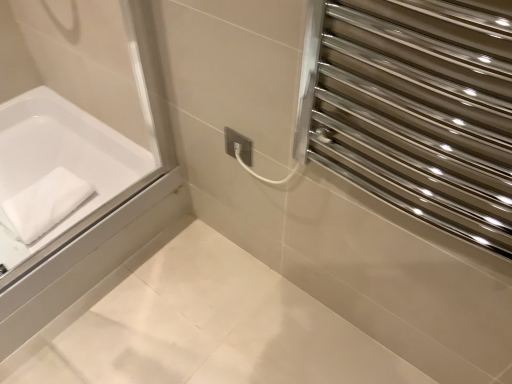
Question: Is polished stainless steel towel rack at upper right positioned in front of white matte bathtub at left?

Choices:
 (A) no
 (B) yes

Answer: (B)

Question: Is polished stainless steel towel rack at upper right to the left of white matte bathtub at left from the viewer's perspective?

Choices:
 (A) no
 (B) yes

Answer: (A)

Question: Is polished stainless steel towel rack at upper right facing towards white matte bathtub at left?

Choices:
 (A) yes
 (B) no

Answer: (B)

Question: Are polished stainless steel towel rack at upper right and white matte bathtub at left located far from each other?

Choices:
 (A) yes
 (B) no

Answer: (B)

Question: Is polished stainless steel towel rack at upper right beside white matte bathtub at left?

Choices:
 (A) no
 (B) yes

Answer: (A)

Question: Looking at their shapes, would you say white matte bathtub at left is wider or thinner than white soft towel at left?

Choices:
 (A) wide
 (B) thin

Answer: (A)

Question: Based on their sizes in the image, would you say white matte bathtub at left is bigger or smaller than white soft towel at left?

Choices:
 (A) small
 (B) big

Answer: (B)

Question: From the image's perspective, is white matte bathtub at left positioned above or below white soft towel at left?

Choices:
 (A) below
 (B) above

Answer: (B)

Question: Is point (45, 160) closer or farther from the camera than point (35, 213)?

Choices:
 (A) closer
 (B) farther

Answer: (B)

Question: From a real-world perspective, is white soft towel at left above or below white matte bathtub at left?

Choices:
 (A) above
 (B) below

Answer: (A)

Question: Considering the positions of white soft towel at left and white matte bathtub at left in the image, is white soft towel at left taller or shorter than white matte bathtub at left?

Choices:
 (A) short
 (B) tall

Answer: (A)

Question: Would you say white soft towel at left is to the left or to the right of white matte bathtub at left in the picture?

Choices:
 (A) right
 (B) left

Answer: (A)

Question: Looking at the image, does white soft towel at left seem bigger or smaller compared to white matte bathtub at left?

Choices:
 (A) big
 (B) small

Answer: (B)

Question: Relative to polished stainless steel towel rack at upper right, is white soft towel at left in front or behind?

Choices:
 (A) front
 (B) behind

Answer: (B)

Question: Is point (44, 198) positioned closer to the camera than point (493, 18)?

Choices:
 (A) closer
 (B) farther

Answer: (B)